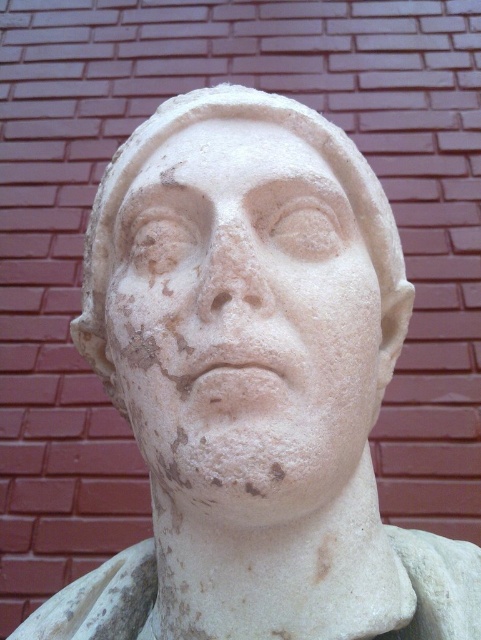
Is point (216, 476) farther from viewer compared to point (296, 148)?

No, (216, 476) is closer to viewer.

Does white marble face at center appear on the right side of white marble forehead at center?

Incorrect, white marble face at center is not on the right side of white marble forehead at center.

The image size is (481, 640). What are the coordinates of `white marble face at center` in the screenshot? It's located at (243, 321).

The width and height of the screenshot is (481, 640). I want to click on white marble face at center, so click(x=243, y=321).